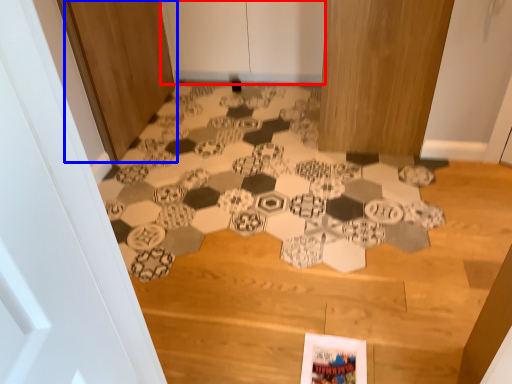
Question: Which object appears farthest to the camera in this image, door (highlighted by a red box) or door (highlighted by a blue box)?

Choices:
 (A) door
 (B) door

Answer: (A)